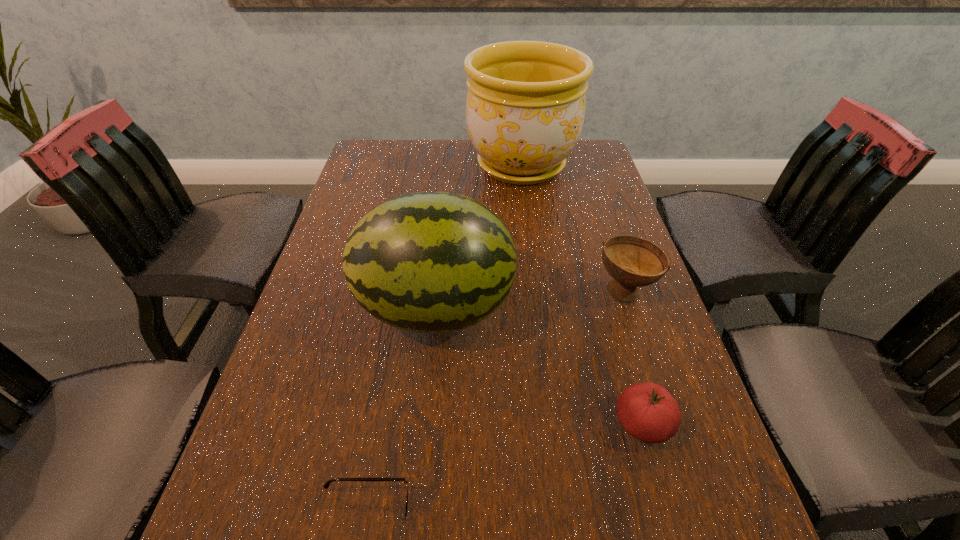
You are a GUI agent. You are given a task and a screenshot of the screen. Output one action in this format:
    pyautogui.click(x=<x>, y=<y>)
    Task: Click on the object at the left edge
    The width and height of the screenshot is (960, 540).
    Given the screenshot: What is the action you would take?
    pyautogui.click(x=427, y=262)

Locate an element on the screen. This screenshot has width=960, height=540. flowerpot present at the right edge is located at coordinates (525, 108).

The image size is (960, 540). Identify the location of soup bowl that is positioned at the right edge. (633, 262).

Locate an element on the screen. tomato that is at the right edge is located at coordinates (647, 411).

I want to click on object that is at the far right corner, so click(525, 108).

You are a GUI agent. You are given a task and a screenshot of the screen. Output one action in this format:
    pyautogui.click(x=<x>, y=<y>)
    Task: Click on the free space at the far edge of the desktop
    
    Given the screenshot: What is the action you would take?
    pyautogui.click(x=470, y=156)

Find the location of a particular element. The width and height of the screenshot is (960, 540). free space at the left edge of the desktop is located at coordinates (324, 348).

What are the coordinates of `vacant space at the right edge` in the screenshot? It's located at (565, 205).

In the image, there is a desktop. Where is `vacant space at the far left corner`? vacant space at the far left corner is located at coordinates (375, 172).

Image resolution: width=960 pixels, height=540 pixels. Identify the location of free region at the far right corner of the desktop. coord(587,141).